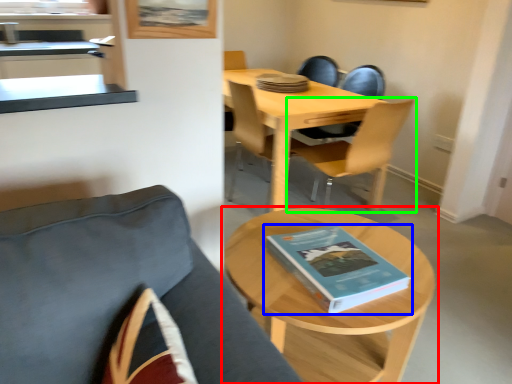
Question: Considering the real-world distances, which object is farthest from coffee table (highlighted by a red box)? book (highlighted by a blue box) or chair (highlighted by a green box)?

Choices:
 (A) book
 (B) chair

Answer: (B)